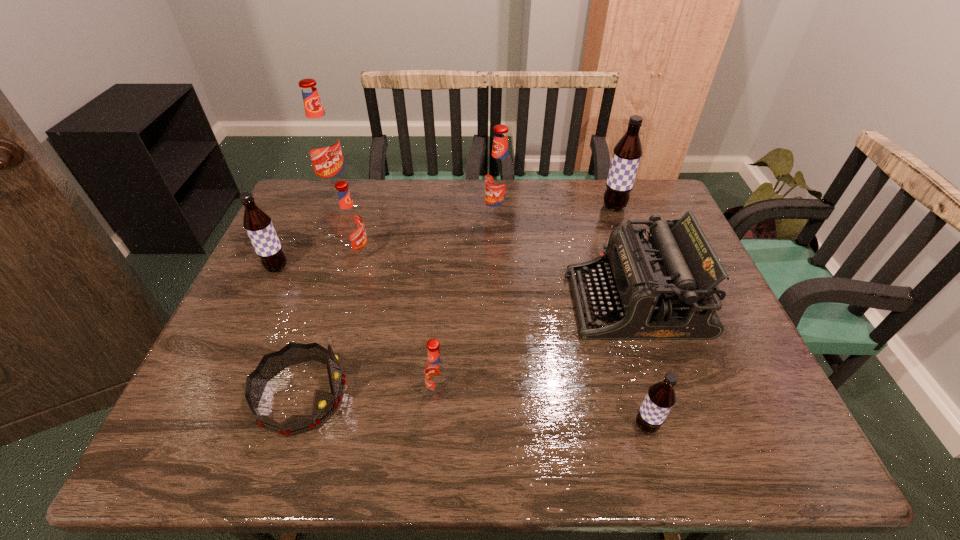
In order to click on free space that satisfies the following two spatial constraints: 1. on the front side of the second smallest brown root beer; 2. on the left side of the fifth object from left to right in this screenshot , I will do pyautogui.click(x=217, y=394).

The height and width of the screenshot is (540, 960). What are the coordinates of `vacant area that satisfies the following two spatial constraints: 1. on the front side of the third red root beer from right to left; 2. on the left side of the smallest brown root beer` in the screenshot? It's located at (309, 426).